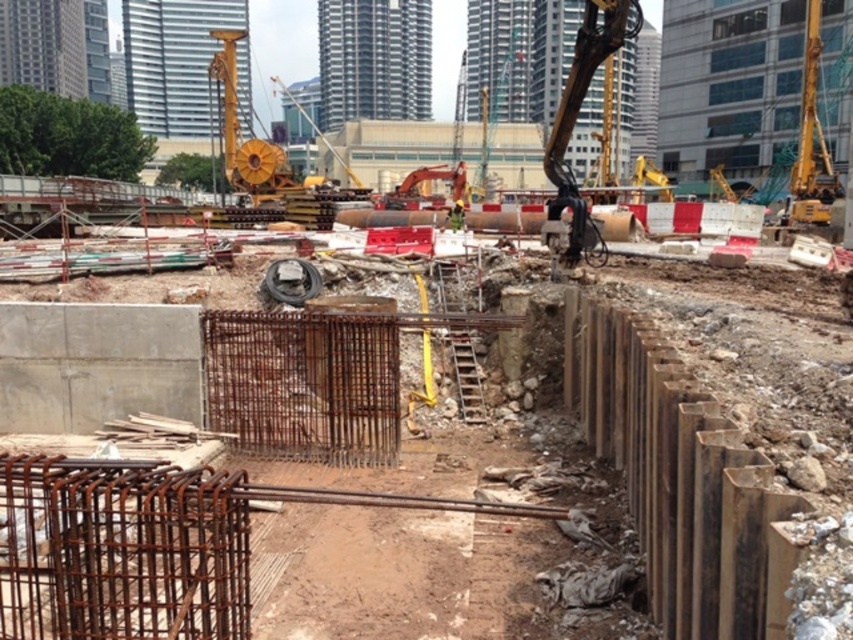
Question: Does rusty metal rebar at center have a greater width compared to metallic arm at upper right?

Choices:
 (A) yes
 (B) no

Answer: (A)

Question: Is metallic arm at upper right thinner than metallic yellow construction worker at center?

Choices:
 (A) no
 (B) yes

Answer: (A)

Question: Estimate the real-world distances between objects in this image. Which object is farther from the rusty metal rebar at center?

Choices:
 (A) metallic arm at upper right
 (B) metallic yellow construction worker at center

Answer: (B)

Question: Among these points, which one is farthest from the camera?

Choices:
 (A) coord(611,20)
 (B) coord(372,440)
 (C) coord(456,221)

Answer: (C)

Question: Is the position of rusty metal rebar at center less distant than that of metallic arm at upper right?

Choices:
 (A) no
 (B) yes

Answer: (B)

Question: Estimate the real-world distances between objects in this image. Which object is closer to the metallic arm at upper right?

Choices:
 (A) metallic yellow construction worker at center
 (B) rusty metal rebar at center

Answer: (A)